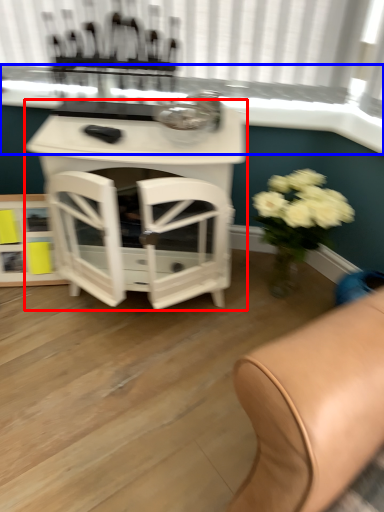
Question: Which point is further to the camera, table (highlighted by a red box) or window sill (highlighted by a blue box)?

Choices:
 (A) table
 (B) window sill

Answer: (B)